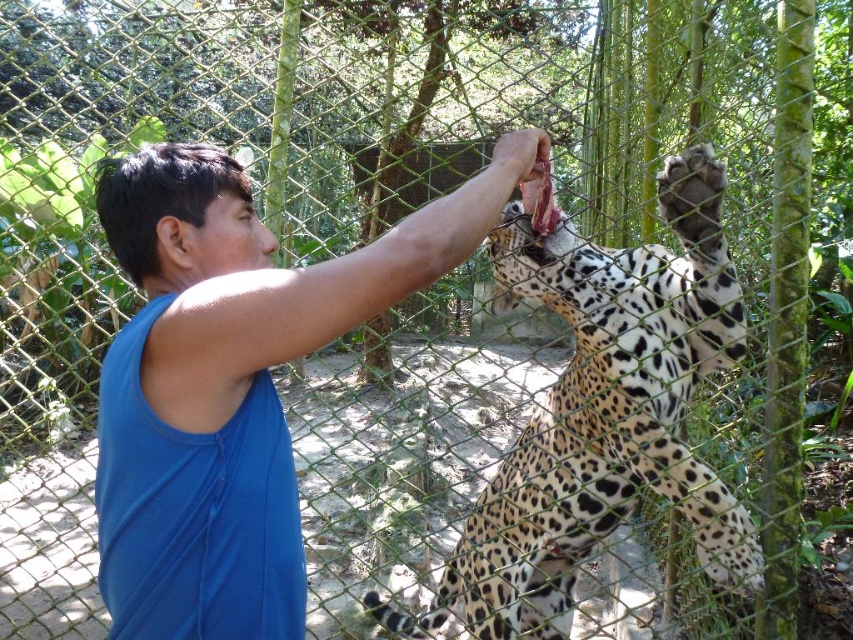
Can you confirm if blue fabric shirt at center is bigger than spotted fur leopard at center?

A: Incorrect, blue fabric shirt at center is not larger than spotted fur leopard at center.

Which is behind, point (193, 548) or point (561, 532)?

The point (561, 532) is behind.

At what (x,y) coordinates should I click in order to perform the action: click on blue fabric shirt at center. Please return your answer as a coordinate pair (x, y). The height and width of the screenshot is (640, 853). Looking at the image, I should click on (233, 381).